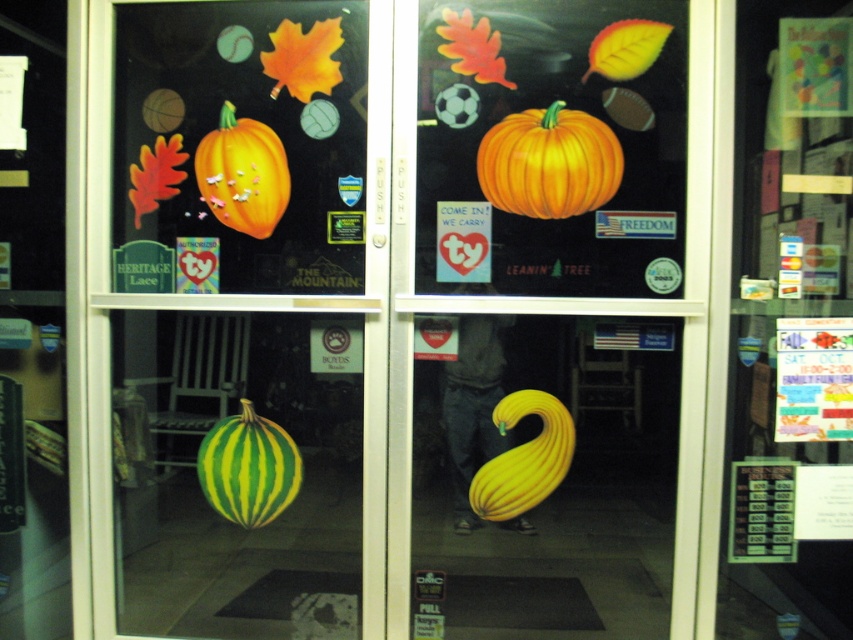
Is yellow rubber duck at center shorter than orange matte pumpkin at center?

No.

Can you confirm if yellow rubber duck at center is positioned below orange matte pumpkin at center?

Yes, yellow rubber duck at center is below orange matte pumpkin at center.

Which is behind, point (585, 608) or point (514, 134)?

Positioned behind is point (585, 608).

The image size is (853, 640). I want to click on yellow rubber duck at center, so 555,490.

This screenshot has width=853, height=640. What do you see at coordinates (549, 163) in the screenshot?
I see `orange matte pumpkin at center` at bounding box center [549, 163].

Who is positioned more to the right, orange matte pumpkin at center or matte orange pumpkin at upper left?

Positioned to the right is orange matte pumpkin at center.

The image size is (853, 640). What do you see at coordinates (549, 163) in the screenshot? I see `orange matte pumpkin at center` at bounding box center [549, 163].

Find the location of a particular element. This screenshot has height=640, width=853. orange matte pumpkin at center is located at coordinates (549, 163).

How distant is green striped pumpkin at lower left from matte orange pumpkin at upper left?

28.49 inches

Is green striped pumpkin at lower left taller than matte orange pumpkin at upper left?

No, green striped pumpkin at lower left is not taller than matte orange pumpkin at upper left.

Find the location of a particular element. This screenshot has width=853, height=640. green striped pumpkin at lower left is located at coordinates (248, 467).